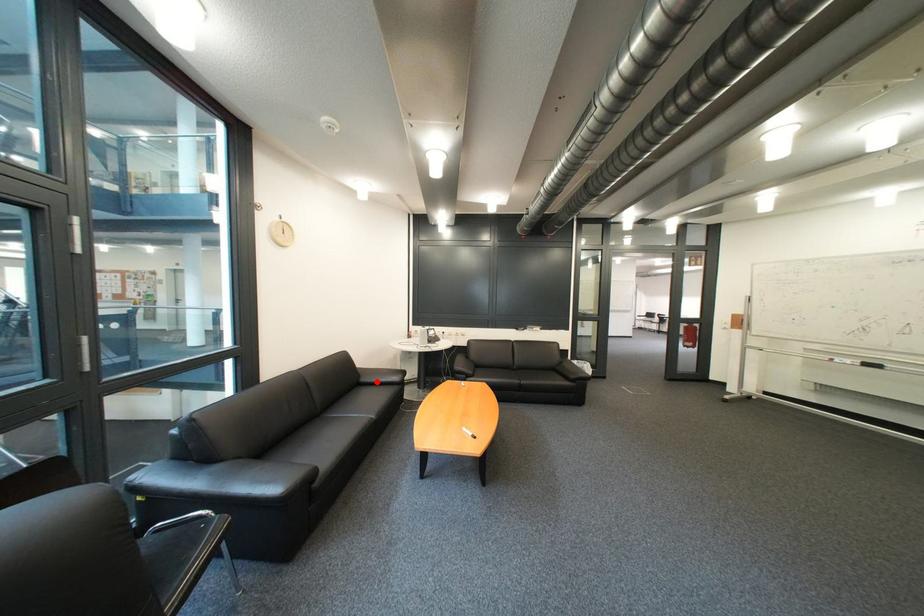
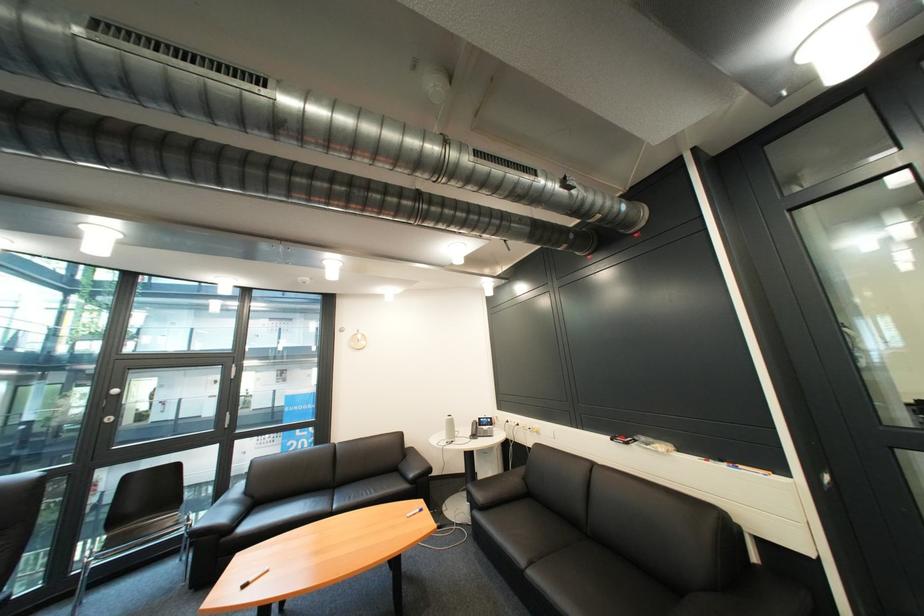
Question: I am providing you with two images of the same scene from different viewpoints. A red point is marked on the first image. Can you still see the location of the red point in image 2?

Choices:
 (A) Yes
 (B) No

Answer: (A)